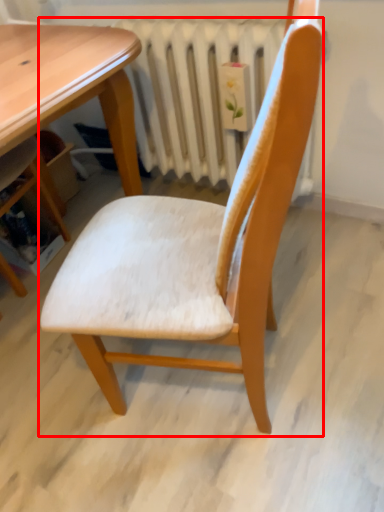
Question: From the image, what is the correct spatial relationship of chair (annotated by the red box) in relation to radiator?

Choices:
 (A) left
 (B) right

Answer: (A)